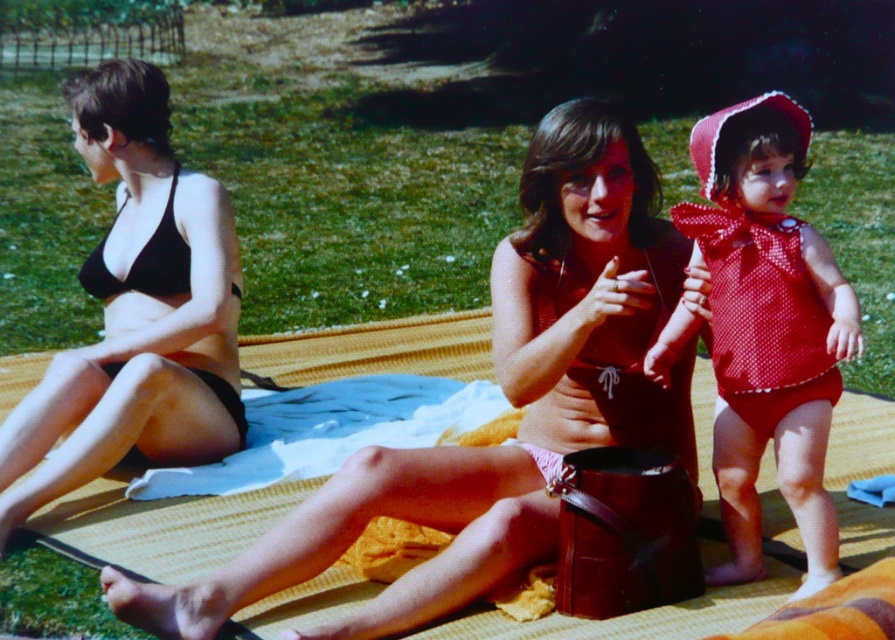
You are standing at the origin point of the coordinate system in this image. The origin is at the bottom left corner of the image. You want to locate the matte red swimsuit at center. Which direction should you move from the origin to reach it?

To locate the matte red swimsuit at center, move right to the x coordinate 0.277 and up to the y coordinate 0.855 from the origin at the bottom left corner.

You are a photographer taking a picture of the two women in the center. You need to adjust your focus so that both the pink matte swimsuit at center and the polka dot fabric swimsuit at center are in sharp focus. Which swimsuit should you focus on to ensure both are clear?

You should focus on the pink matte swimsuit at center because it is closer to the viewer, and focusing on the closer object will ensure the polka dot fabric swimsuit at center, which is farther away, is also in focus.